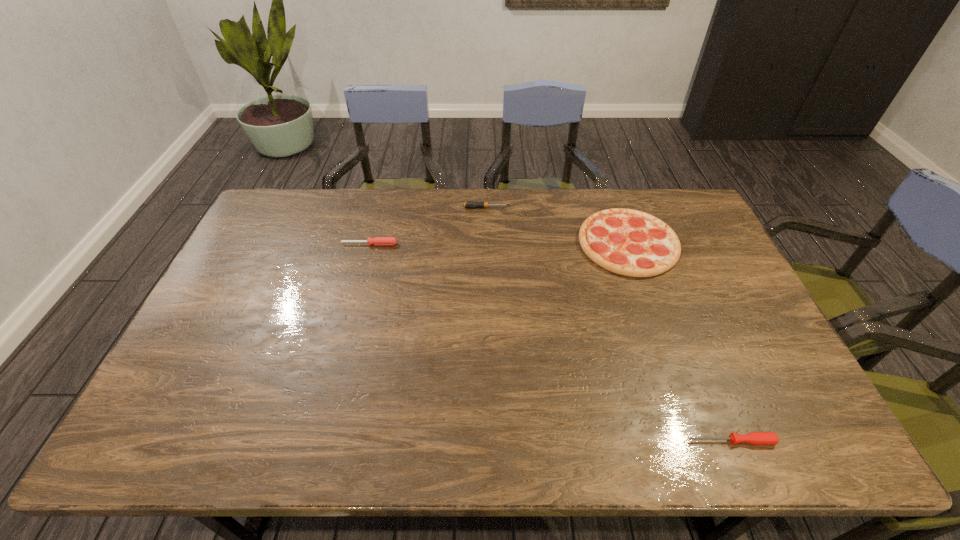
The image size is (960, 540). In order to click on vacant point that satisfies the following two spatial constraints: 1. on the back side of the leftmost screwdriver; 2. on the left side of the pizza in this screenshot , I will do `click(370, 244)`.